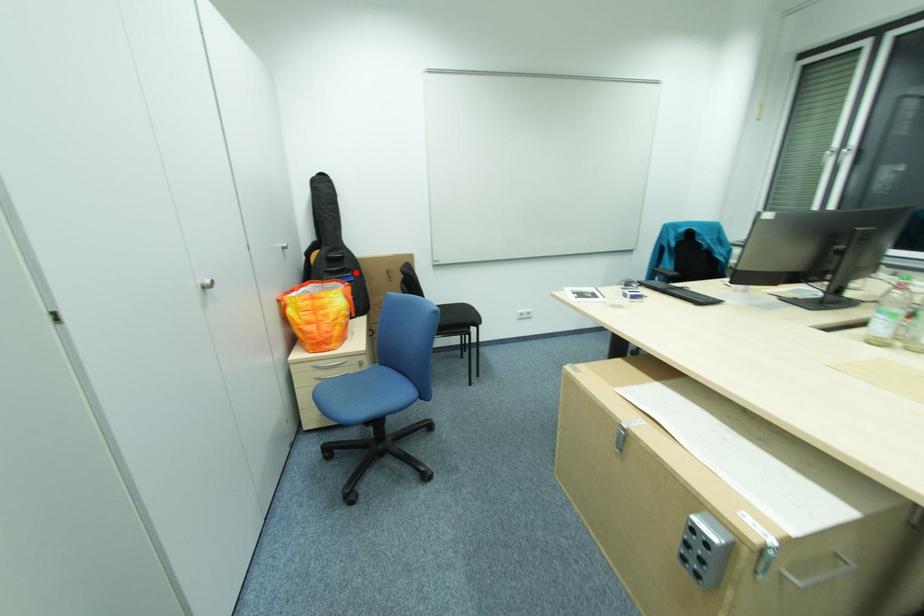
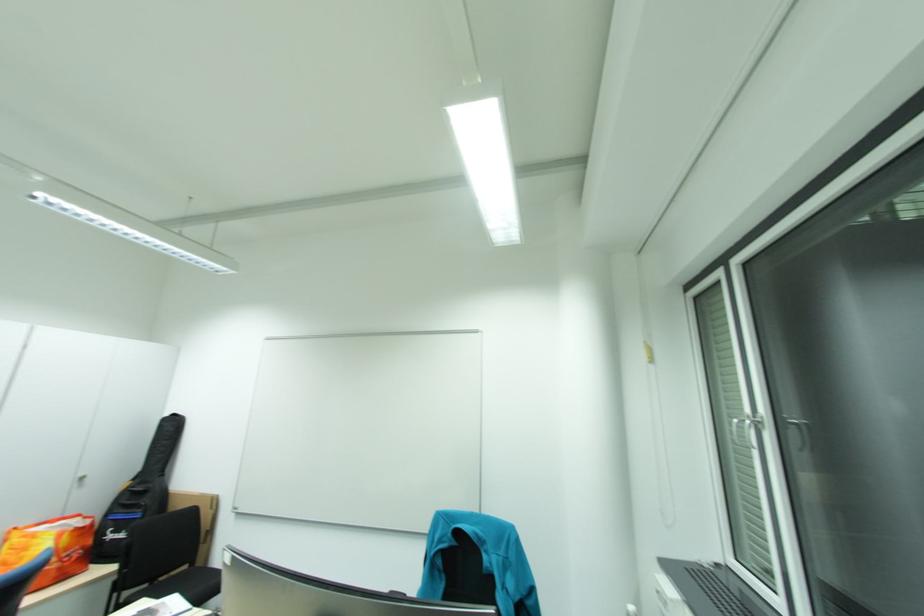
The point at the highlighted location is marked in the first image. Where is the corresponding point in the second image?

(149, 508)